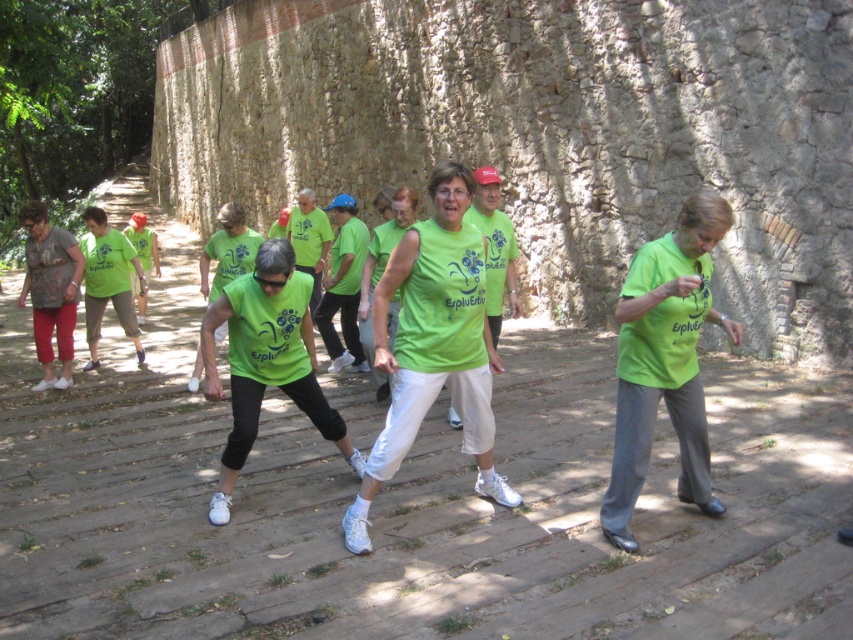
You are a photographer taking pictures of the exercise group. You notice two green shirts at the center of the image. Which one is positioned lower between the green matte tank top at center and the green fabric shirt at center?

The green matte tank top at center is positioned lower than the green fabric shirt at center.

You are a photographer trying to capture a photo of the group. You notice the green matte shirt at center and the matte gray shirt at left. Which shirt should you focus on to ensure the one on the right side is in the frame?

You should focus on the green matte shirt at center because it is positioned on the right side of the matte gray shirt at left, making it the shirt on the right.